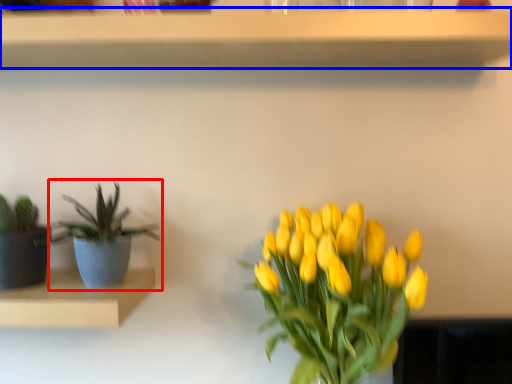
Question: Which object appears farthest to the camera in this image, houseplant (highlighted by a red box) or shelf (highlighted by a blue box)?

Choices:
 (A) houseplant
 (B) shelf

Answer: (A)